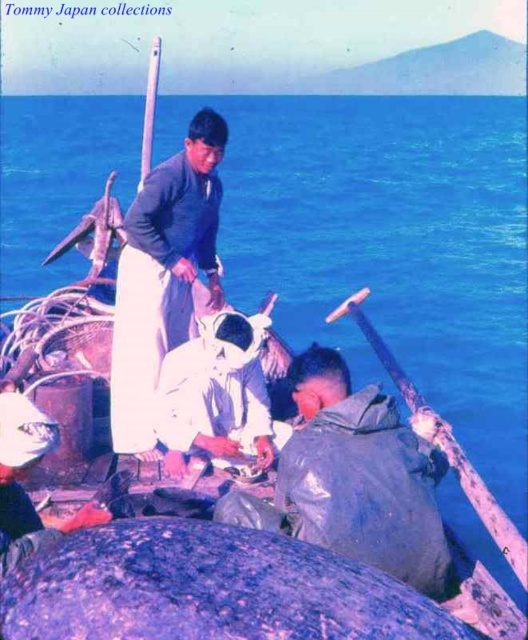
Question: Which point appears closest to the camera in this image?

Choices:
 (A) (116, 355)
 (B) (244, 381)

Answer: (B)

Question: Which point is farther from the camera taking this photo?

Choices:
 (A) (259, 317)
 (B) (328, 544)

Answer: (A)

Question: Can you confirm if matte blue shirt at center is positioned above white matte shirt at center?

Choices:
 (A) no
 (B) yes

Answer: (A)

Question: Does gray matte jacket at lower right have a lesser width compared to white matte shirt at center?

Choices:
 (A) yes
 (B) no

Answer: (B)

Question: Which point is farther from the camera taking this photo?

Choices:
 (A) (223, 451)
 (B) (335, 536)

Answer: (A)

Question: Can you confirm if gray matte jacket at lower right is positioned to the right of matte blue shirt at center?

Choices:
 (A) no
 (B) yes

Answer: (B)